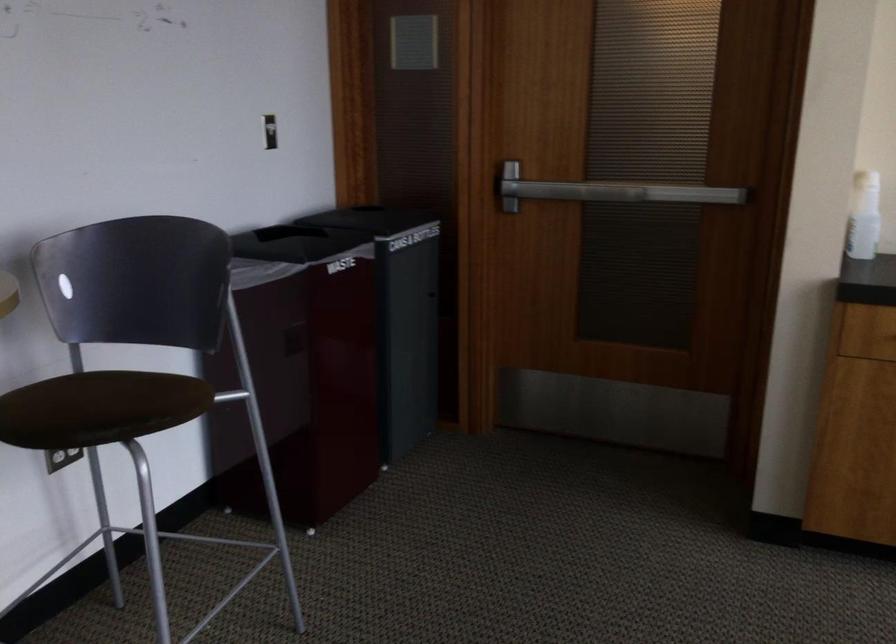
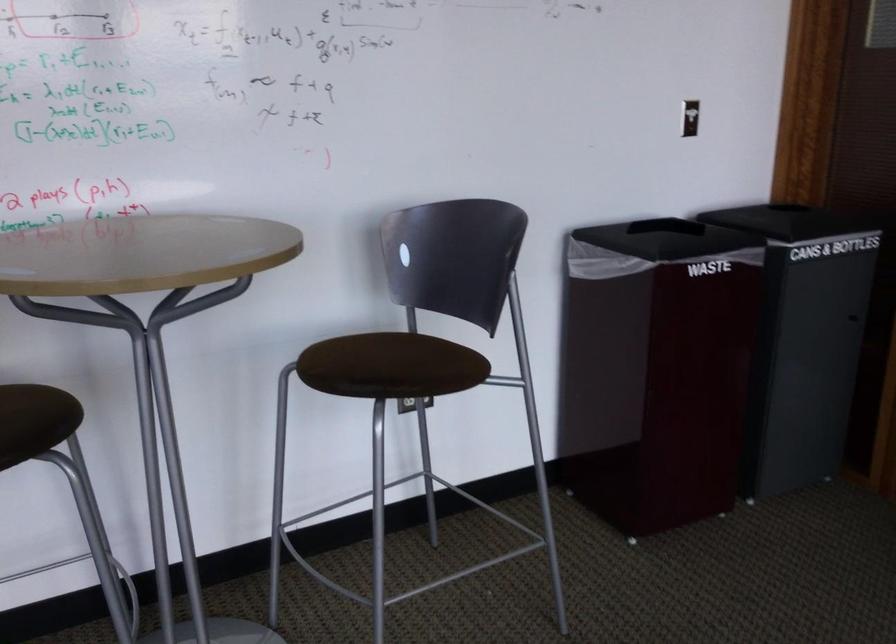
Find the pixel in the second image that matches (106,402) in the first image.

(391, 366)